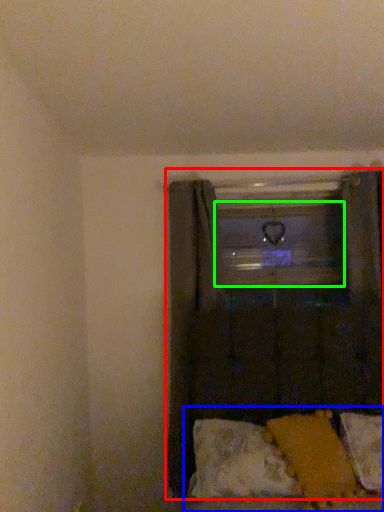
Question: Which object is positioned closest to curtain (highlighted by a red box)? Select from bed (highlighted by a blue box) and window frame (highlighted by a green box).

Choices:
 (A) bed
 (B) window frame

Answer: (B)